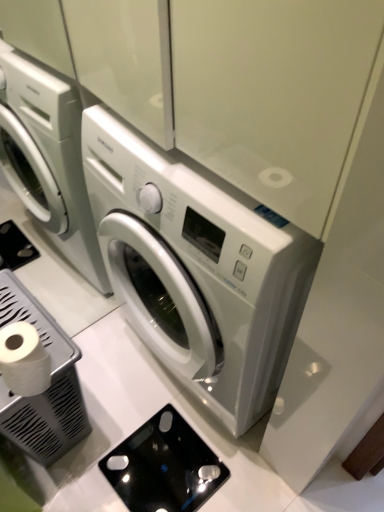
This screenshot has height=512, width=384. I want to click on empty space that is to the right of black glass scale at lower center, acting as the 2th appliance starting from the left, so click(x=245, y=470).